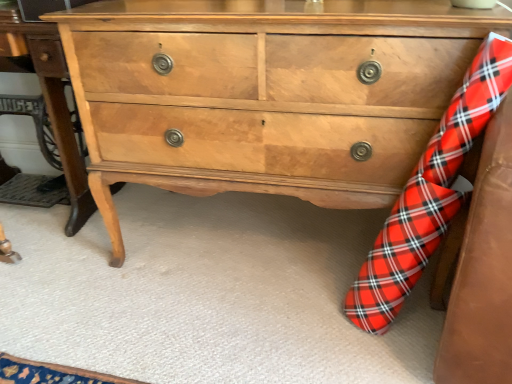
Question: Can you confirm if red plaid sock at lower right is bigger than light brown wood table at center?

Choices:
 (A) no
 (B) yes

Answer: (A)

Question: Is red plaid sock at lower right at the left side of light brown wood table at center?

Choices:
 (A) yes
 (B) no

Answer: (B)

Question: Is red plaid sock at lower right looking in the opposite direction of light brown wood table at center?

Choices:
 (A) no
 (B) yes

Answer: (A)

Question: Is red plaid sock at lower right aimed at light brown wood table at center?

Choices:
 (A) yes
 (B) no

Answer: (B)

Question: Would you consider red plaid sock at lower right to be distant from light brown wood table at center?

Choices:
 (A) no
 (B) yes

Answer: (B)

Question: Considering the positions of red plaid sock at lower right and light brown wood table at center in the image, is red plaid sock at lower right taller or shorter than light brown wood table at center?

Choices:
 (A) short
 (B) tall

Answer: (B)

Question: Based on their sizes in the image, would you say red plaid sock at lower right is bigger or smaller than light brown wood table at center?

Choices:
 (A) big
 (B) small

Answer: (B)

Question: Is red plaid sock at lower right in front of or behind light brown wood table at center in the image?

Choices:
 (A) front
 (B) behind

Answer: (A)

Question: In terms of width, does red plaid sock at lower right look wider or thinner when compared to light brown wood table at center?

Choices:
 (A) wide
 (B) thin

Answer: (B)

Question: Is light brown wood table at center wider or thinner than light brown wood chest of drawers at center?

Choices:
 (A) wide
 (B) thin

Answer: (B)

Question: From their relative heights in the image, would you say light brown wood table at center is taller or shorter than light brown wood chest of drawers at center?

Choices:
 (A) tall
 (B) short

Answer: (B)

Question: Considering their positions, is light brown wood table at center located in front of or behind light brown wood chest of drawers at center?

Choices:
 (A) front
 (B) behind

Answer: (B)

Question: From the image's perspective, is light brown wood table at center positioned above or below light brown wood chest of drawers at center?

Choices:
 (A) above
 (B) below

Answer: (A)

Question: From their relative heights in the image, would you say light brown wood table at center is taller or shorter than red plaid sock at lower right?

Choices:
 (A) short
 (B) tall

Answer: (A)

Question: Relative to red plaid sock at lower right, is light brown wood table at center in front or behind?

Choices:
 (A) front
 (B) behind

Answer: (B)